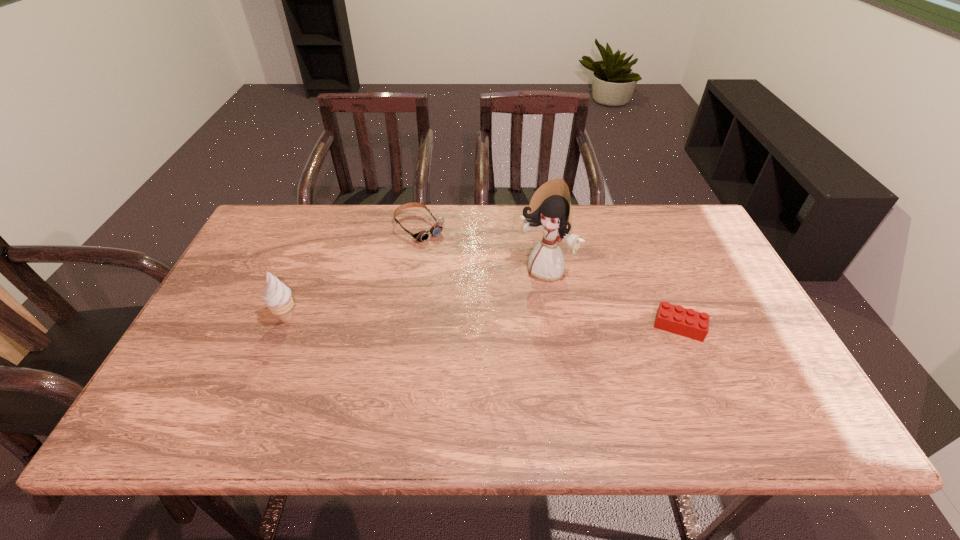
Where is `vacant space situated 0.080m on the front of the shortest object`? vacant space situated 0.080m on the front of the shortest object is located at coordinates (697, 370).

At what (x,y) coordinates should I click in order to perform the action: click on free space located at the front face of the tallest object. Please return your answer as a coordinate pair (x, y). Looking at the image, I should click on pos(509,313).

Where is `free space located at the front face of the tallest object`? The width and height of the screenshot is (960, 540). free space located at the front face of the tallest object is located at coordinates (495, 327).

Find the location of a particular element. The width and height of the screenshot is (960, 540). vacant space situated 0.180m at the front face of the tallest object is located at coordinates (495, 327).

The width and height of the screenshot is (960, 540). What are the coordinates of `free region located on the front-facing side of the second object from left to right` in the screenshot? It's located at (448, 254).

Where is `free space located 0.360m on the front-facing side of the second object from left to right`? The image size is (960, 540). free space located 0.360m on the front-facing side of the second object from left to right is located at coordinates (510, 309).

Locate an element on the screen. Image resolution: width=960 pixels, height=540 pixels. free region located on the front-facing side of the second object from left to right is located at coordinates (486, 288).

The image size is (960, 540). What are the coordinates of `object situated at the far edge` in the screenshot? It's located at (422, 236).

What are the coordinates of `object that is at the right edge` in the screenshot? It's located at (689, 323).

You are a GUI agent. You are given a task and a screenshot of the screen. Output one action in this format:
    pyautogui.click(x=<x>, y=<y>)
    Task: Click on the vacant space at the far edge
    The width and height of the screenshot is (960, 540).
    Given the screenshot: What is the action you would take?
    pyautogui.click(x=308, y=241)